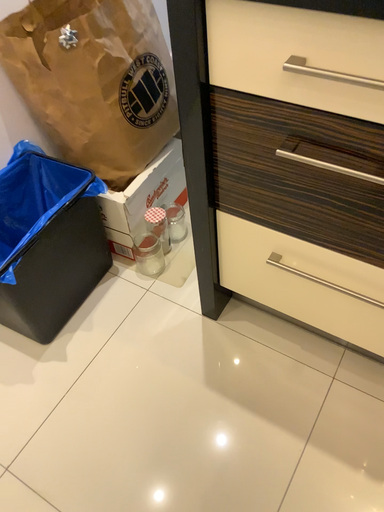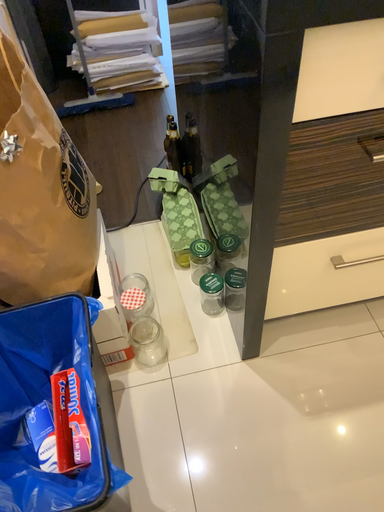
Question: How did the camera likely rotate when shooting the video?

Choices:
 (A) rotated downward
 (B) rotated upward

Answer: (B)